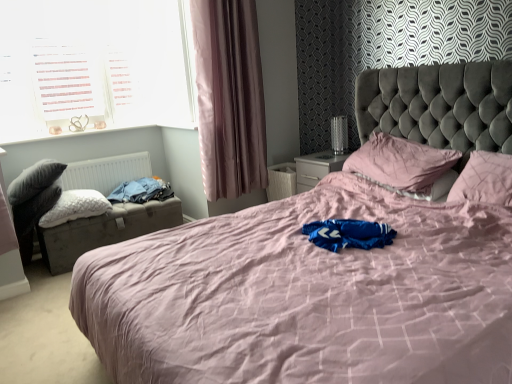
Question: Is leatherette storage trunk at left in front of dark grey fabric swivel chair at left?

Choices:
 (A) no
 (B) yes

Answer: (A)

Question: Can dark grey fabric swivel chair at left be found inside leatherette storage trunk at left?

Choices:
 (A) yes
 (B) no

Answer: (B)

Question: Are leatherette storage trunk at left and dark grey fabric swivel chair at left beside each other?

Choices:
 (A) yes
 (B) no

Answer: (B)

Question: From the image's perspective, does leatherette storage trunk at left appear lower than dark grey fabric swivel chair at left?

Choices:
 (A) no
 (B) yes

Answer: (B)

Question: From a real-world perspective, is leatherette storage trunk at left on dark grey fabric swivel chair at left?

Choices:
 (A) no
 (B) yes

Answer: (A)

Question: Is pink fabric bed at center bigger or smaller than pink satin curtain at left?

Choices:
 (A) big
 (B) small

Answer: (A)

Question: Does point (403, 273) appear closer or farther from the camera than point (253, 129)?

Choices:
 (A) farther
 (B) closer

Answer: (B)

Question: From a real-world perspective, is pink fabric bed at center above or below pink satin curtain at left?

Choices:
 (A) below
 (B) above

Answer: (A)

Question: Is pink fabric bed at center inside or outside of pink satin curtain at left?

Choices:
 (A) outside
 (B) inside

Answer: (A)

Question: From the image's perspective, relative to leatherette storage trunk at left, is white matte radiator at left above or below?

Choices:
 (A) below
 (B) above

Answer: (B)

Question: Based on their positions, is white matte radiator at left located to the left or right of leatherette storage trunk at left?

Choices:
 (A) left
 (B) right

Answer: (A)

Question: Would you say white matte radiator at left is inside or outside leatherette storage trunk at left?

Choices:
 (A) inside
 (B) outside

Answer: (B)

Question: Is white matte radiator at left wider or thinner than leatherette storage trunk at left?

Choices:
 (A) thin
 (B) wide

Answer: (A)

Question: Is point (14, 139) closer or farther from the camera than point (106, 205)?

Choices:
 (A) farther
 (B) closer

Answer: (A)

Question: Considering the positions of white plastic window at upper left and white fluffy pillow at left, arranged as the 3th pillow when viewed from the right, in the image, is white plastic window at upper left bigger or smaller than white fluffy pillow at left, arranged as the 3th pillow when viewed from the right,?

Choices:
 (A) big
 (B) small

Answer: (A)